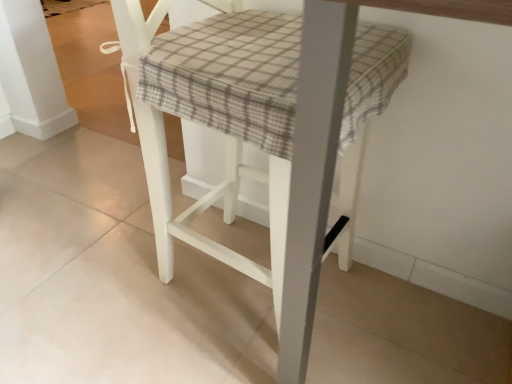
This screenshot has height=384, width=512. What are the coordinates of `white fabric-covered stool at center` in the screenshot? It's located at (261, 173).

What do you see at coordinates (261, 173) in the screenshot? The width and height of the screenshot is (512, 384). I see `white fabric-covered stool at center` at bounding box center [261, 173].

What is the approximate width of white fabric-covered stool at center?

white fabric-covered stool at center is 51.05 centimeters in width.

This screenshot has height=384, width=512. Find the location of `white fabric-covered stool at center`. white fabric-covered stool at center is located at coordinates (261, 173).